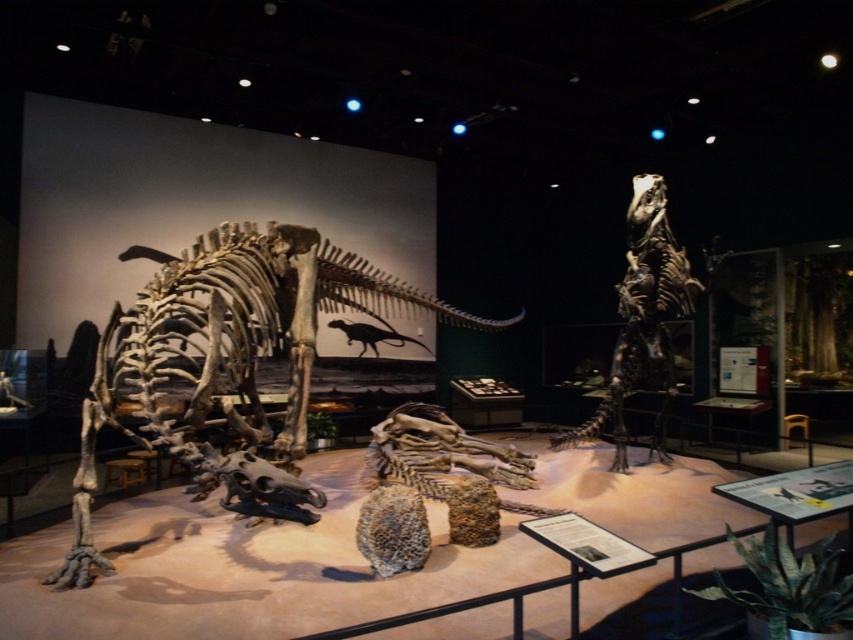
You are a visitor standing in the museum exhibit and want to take a photo of both the sauropod skeleton and the T. rex skeleton. You notice two points marked in the image, point 1 at coordinates point (331, 307) and point 2 at coordinates point (618, 385). Which point is closer to you, the visitor?

Point (331, 307) is closer to you than point (618, 385) because it is further to the viewer.